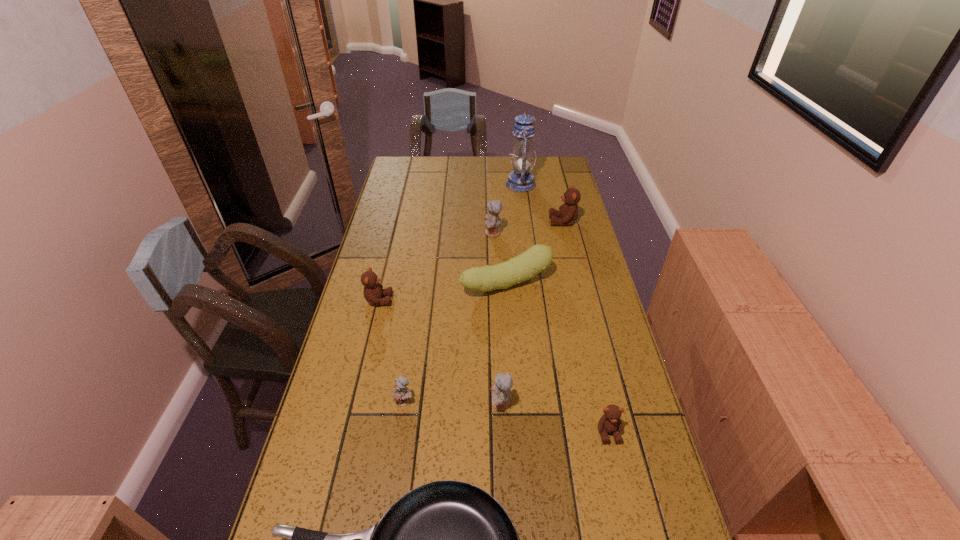
This screenshot has width=960, height=540. What are the coordinates of `the nearest brown teddy bear` in the screenshot? It's located at (x=610, y=422).

Where is `the nearest teddy bear`? The width and height of the screenshot is (960, 540). the nearest teddy bear is located at coordinates (610, 422).

Locate an element on the screen. free spot located on the front-facing side of the farthest object is located at coordinates (479, 184).

Find the location of `vacant space located on the front-facing side of the farthest object`. vacant space located on the front-facing side of the farthest object is located at coordinates (484, 184).

At what (x,y) coordinates should I click in order to perform the action: click on free point located 0.170m on the front-facing side of the farthest object. Please return your answer as a coordinate pair (x, y). This screenshot has width=960, height=540. Looking at the image, I should click on (468, 184).

This screenshot has width=960, height=540. I want to click on free spot located on the front-facing side of the biggest blue teddy bear, so click(x=384, y=233).

The height and width of the screenshot is (540, 960). In order to click on vacant space located 0.300m on the front-facing side of the biggest blue teddy bear in this screenshot , I will do `click(407, 233)`.

You are a GUI agent. You are given a task and a screenshot of the screen. Output one action in this format:
    pyautogui.click(x=<x>, y=<y>)
    Task: Click on the free region located on the front-facing side of the biggest blue teddy bear
    This screenshot has height=540, width=960.
    Given the screenshot: What is the action you would take?
    click(x=456, y=233)

This screenshot has width=960, height=540. Find the location of `vacant region located 0.060m on the face of the farthest brown teddy bear`. vacant region located 0.060m on the face of the farthest brown teddy bear is located at coordinates (535, 221).

In order to click on vacant space located on the face of the farthest brown teddy bear in this screenshot , I will do `click(463, 221)`.